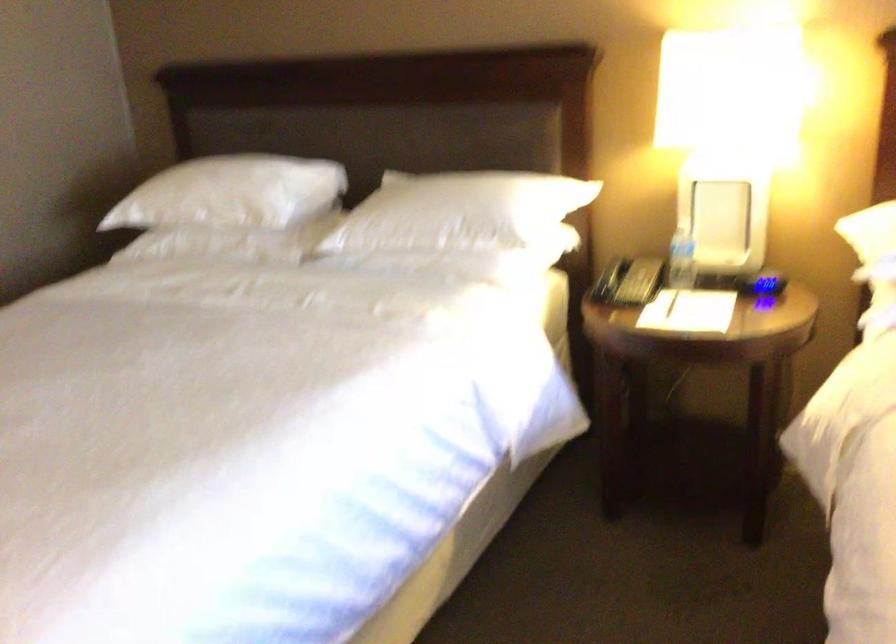
Where is `telephone handset`? Image resolution: width=896 pixels, height=644 pixels. telephone handset is located at coordinates (609, 278).